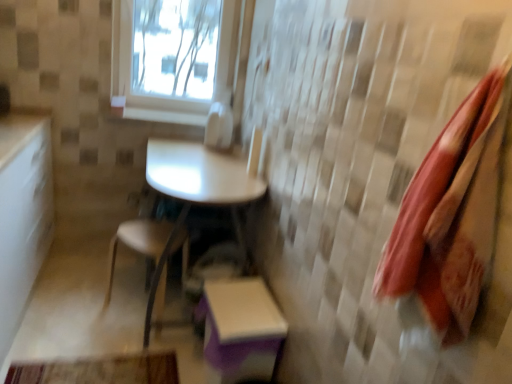
Question: Could you tell me if red fabric towel at right is facing white glossy window sill at upper center?

Choices:
 (A) no
 (B) yes

Answer: (A)

Question: Considering the relative positions of red fabric towel at right and white glossy window sill at upper center in the image provided, is red fabric towel at right to the right of white glossy window sill at upper center from the viewer's perspective?

Choices:
 (A) yes
 (B) no

Answer: (A)

Question: Can you see red fabric towel at right touching white glossy window sill at upper center?

Choices:
 (A) yes
 (B) no

Answer: (B)

Question: Considering the relative sizes of red fabric towel at right and white glossy window sill at upper center in the image provided, is red fabric towel at right smaller than white glossy window sill at upper center?

Choices:
 (A) no
 (B) yes

Answer: (A)

Question: From a real-world perspective, is red fabric towel at right physically above white glossy window sill at upper center?

Choices:
 (A) yes
 (B) no

Answer: (A)

Question: Considering the relative sizes of red fabric towel at right and white glossy window sill at upper center in the image provided, is red fabric towel at right thinner than white glossy window sill at upper center?

Choices:
 (A) no
 (B) yes

Answer: (B)

Question: Is white glossy table at center behind red fabric towel at right?

Choices:
 (A) no
 (B) yes

Answer: (B)

Question: Considering the relative sizes of white glossy table at center and red fabric towel at right in the image provided, is white glossy table at center shorter than red fabric towel at right?

Choices:
 (A) yes
 (B) no

Answer: (B)

Question: Is white glossy table at center oriented towards red fabric towel at right?

Choices:
 (A) no
 (B) yes

Answer: (A)

Question: Could red fabric towel at right be considered to be inside white glossy table at center?

Choices:
 (A) yes
 (B) no

Answer: (B)

Question: Is white glossy table at center at the right side of red fabric towel at right?

Choices:
 (A) yes
 (B) no

Answer: (B)

Question: Considering the relative sizes of white glossy table at center and red fabric towel at right in the image provided, is white glossy table at center wider than red fabric towel at right?

Choices:
 (A) no
 (B) yes

Answer: (B)

Question: Is the surface of white glossy table at center in direct contact with transparent glass window at upper center?

Choices:
 (A) no
 (B) yes

Answer: (A)